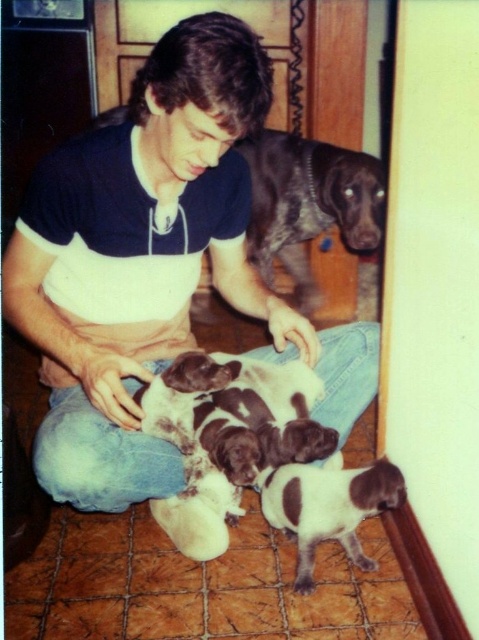
You are a photographer trying to capture a closeup of the shiny brown dog at upper center. Based on its position, where should you aim your camera?

The shiny brown dog at upper center is located at point (308, 204), so aim your camera towards those coordinates for the best shot.